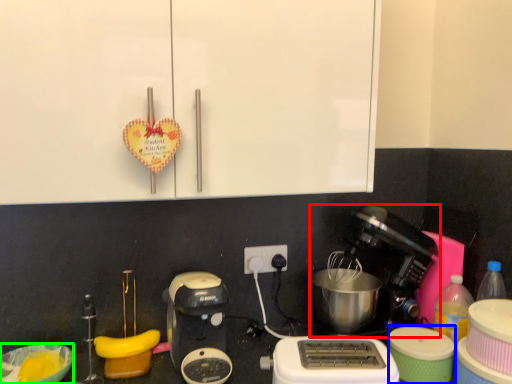
Question: Considering the real-world distances, which object is farthest from coffee maker (highlighted by a red box)? appliance (highlighted by a blue box) or bowl (highlighted by a green box)?

Choices:
 (A) appliance
 (B) bowl

Answer: (B)